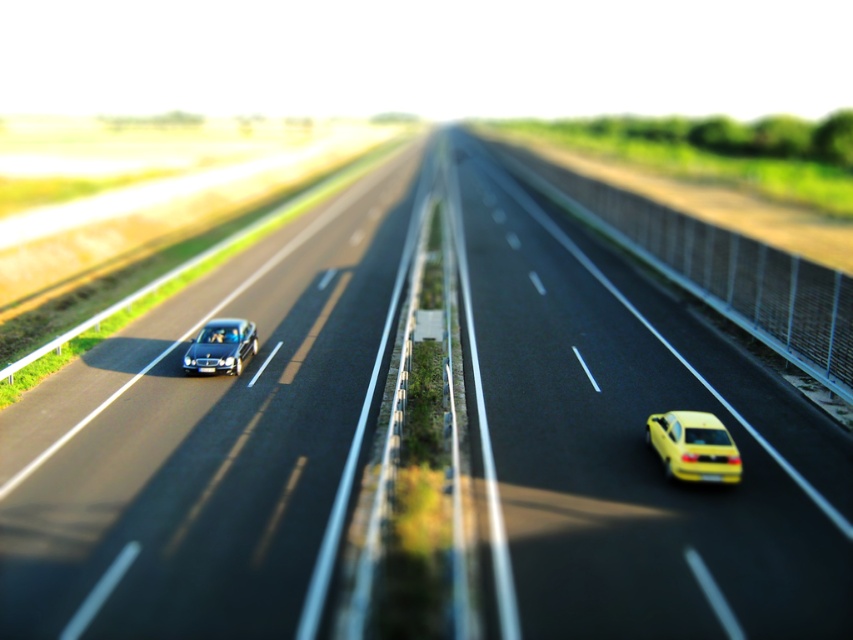
Does shiny yellow car at right have a lesser width compared to shiny metallic sedan at left?

Yes.

Is shiny yellow car at right further to the viewer compared to shiny metallic sedan at left?

No, it is in front of shiny metallic sedan at left.

Does point (698, 413) come in front of point (254, 324)?

Yes.

The width and height of the screenshot is (853, 640). Identify the location of shiny yellow car at right. (693, 445).

Measure the distance between shiny metallic car at center and camera.

shiny metallic car at center and camera are 8.02 meters apart.

You are a GUI agent. You are given a task and a screenshot of the screen. Output one action in this format:
    pyautogui.click(x=<x>, y=<y>)
    Task: Click on the shiny metallic car at center
    Image resolution: width=853 pixels, height=640 pixels.
    Given the screenshot: What is the action you would take?
    pyautogui.click(x=212, y=442)

Which is in front, point (641, 305) or point (733, 480)?

Positioned in front is point (733, 480).

Is yellow matte car at right to the left of shiny yellow car at right from the viewer's perspective?

In fact, yellow matte car at right is to the right of shiny yellow car at right.

Is point (515, 182) in front of point (659, 419)?

No, it is behind (659, 419).

You are a GUI agent. You are given a task and a screenshot of the screen. Output one action in this format:
    pyautogui.click(x=<x>, y=<y>)
    Task: Click on the yellow matte car at right
    This screenshot has width=853, height=640.
    Given the screenshot: What is the action you would take?
    pyautogui.click(x=636, y=444)